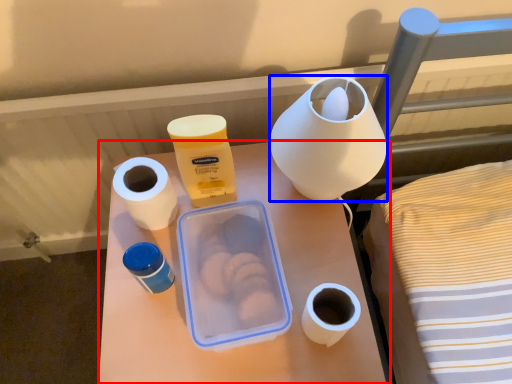
Question: Which of the following is the farthest to the observer, table (highlighted by a red box) or pottery (highlighted by a blue box)?

Choices:
 (A) table
 (B) pottery

Answer: (A)